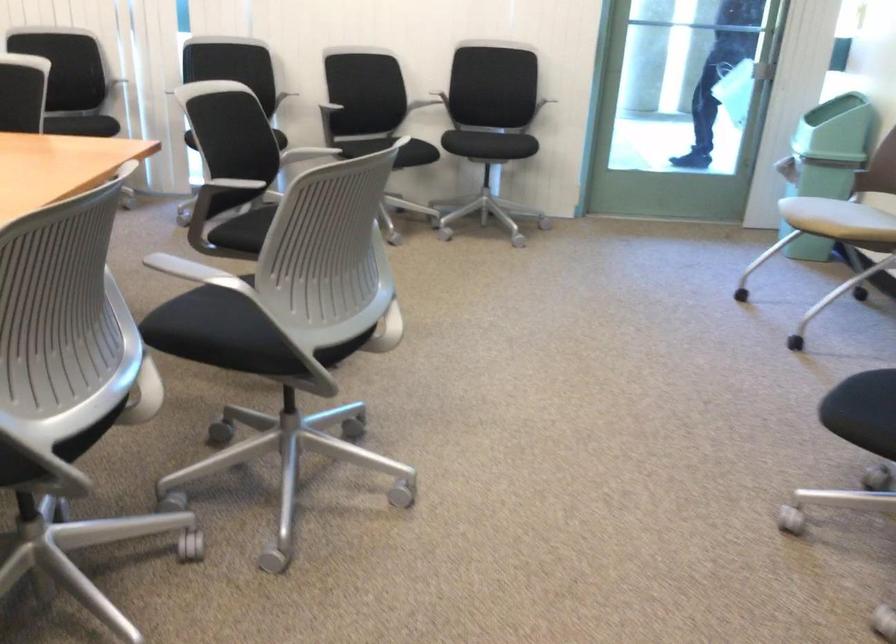
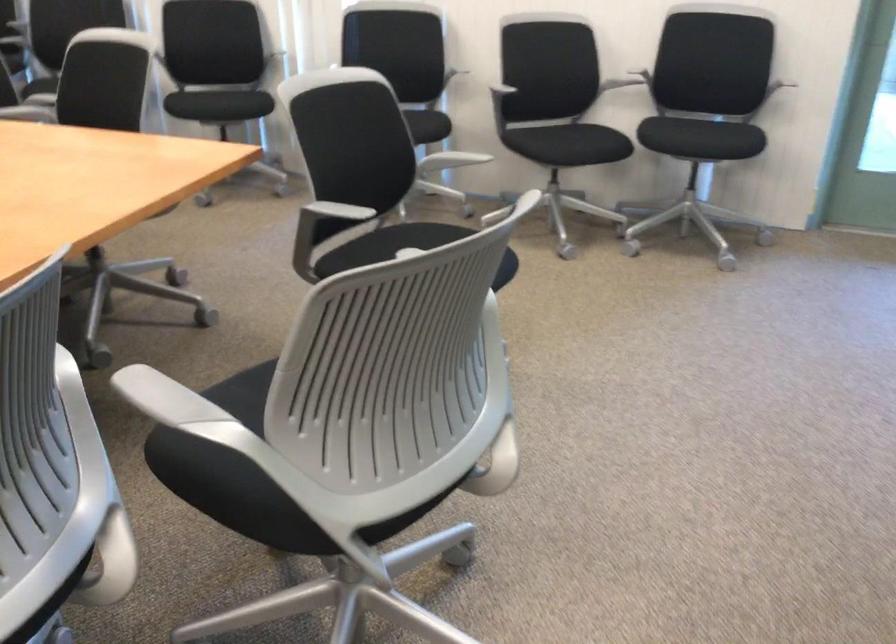
Locate, in the second image, the point that corresponds to pixel 342 109 in the first image.

(510, 96)